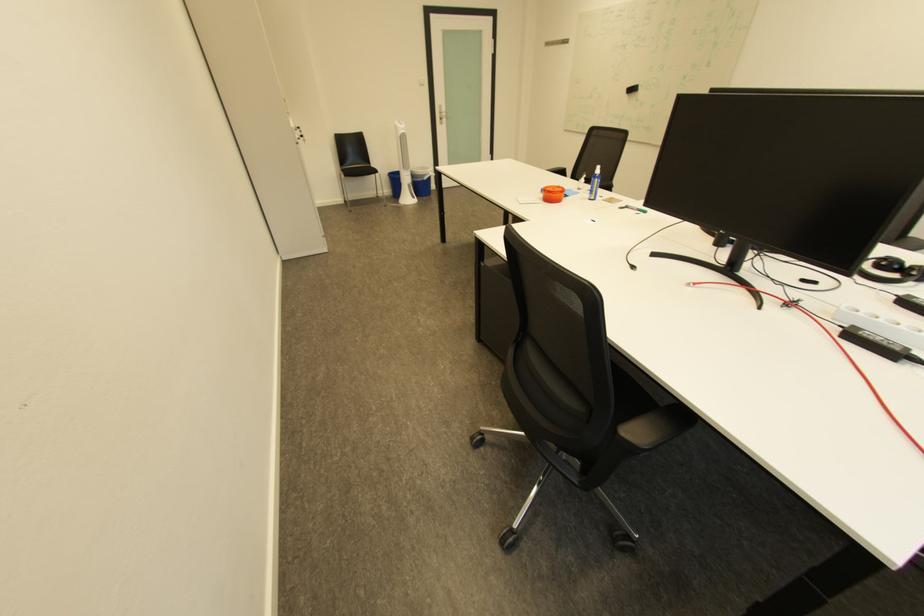
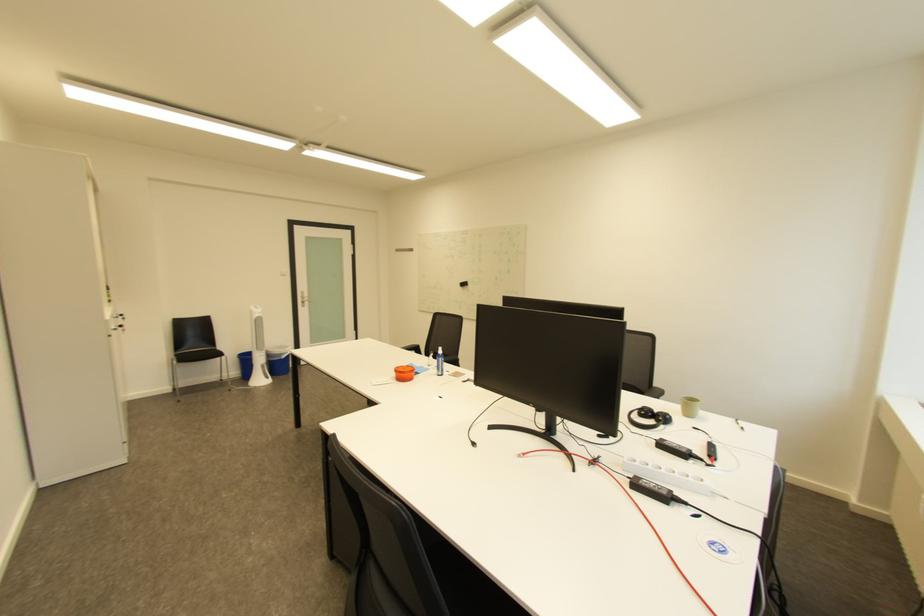
Find the pixel in the second image that matches pixel 587 193 in the first image.

(436, 371)